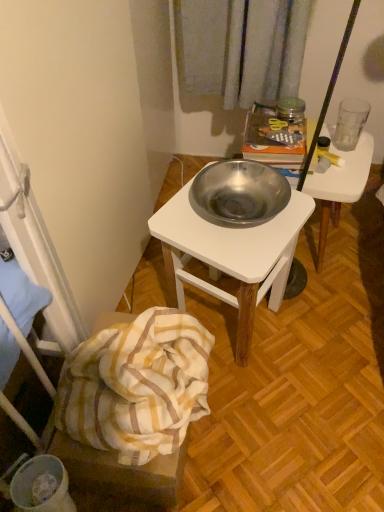
The width and height of the screenshot is (384, 512). I want to click on free spot in front of polished stainless steel bowl at center, which is the second desk in right-to-left order, so click(266, 413).